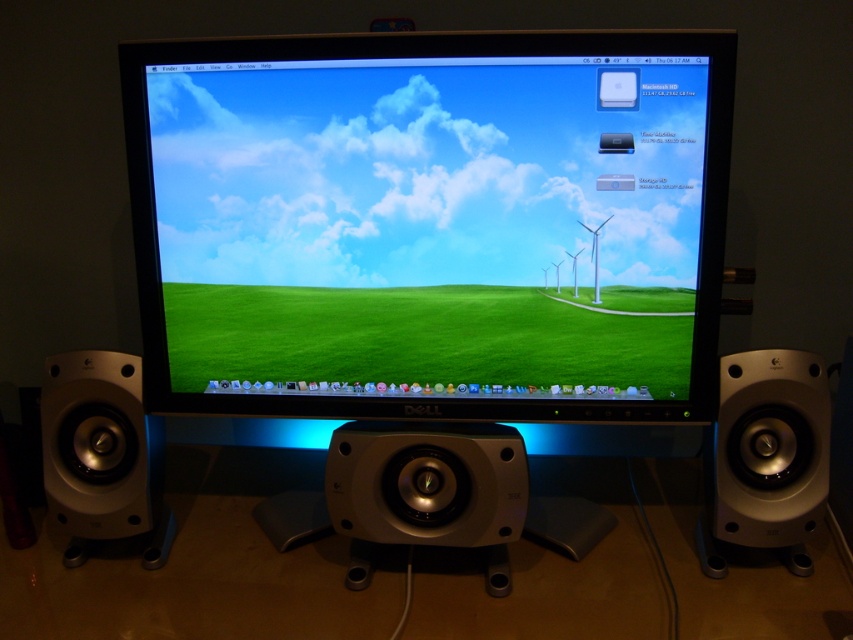
You are setting up a new computer desk and want to place a decorative plant between the silver metallic speaker at right and the silver metallic speaker at left. Based on their positions, can you determine if the plant will fit horizontally between them?

The silver metallic speaker at right is located above the silver metallic speaker at left, so their horizontal positions overlap. The plant can fit between them horizontally as long as there is enough space along the horizontal axis between the two speakers.

You are setting up a new webcam for your online classes. The camera needs to be placed exactly between the silver metallic speaker at right and another object. Which object should you place the camera between to ensure it is centered?

The camera should be placed between the silver metallic speaker at right and the camera itself to ensure it is centered, as they are 38.97 inches apart.